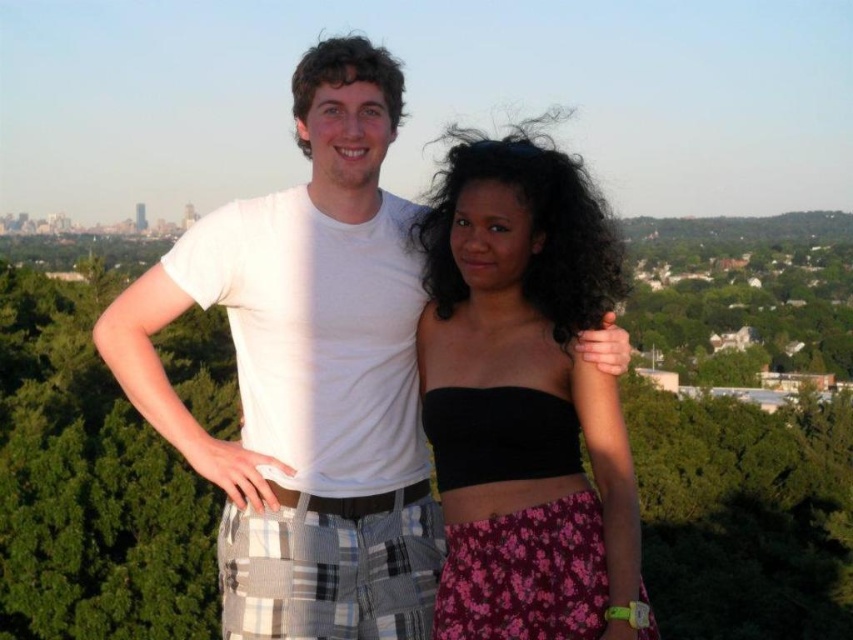
The image size is (853, 640). Find the location of `white cotton t-shirt at center`. white cotton t-shirt at center is located at coordinates (306, 374).

Between white cotton t-shirt at center and black matte strapless top at center, which one appears on the right side from the viewer's perspective?

black matte strapless top at center is more to the right.

The width and height of the screenshot is (853, 640). Identify the location of white cotton t-shirt at center. (306, 374).

You are a GUI agent. You are given a task and a screenshot of the screen. Output one action in this format:
    pyautogui.click(x=<x>, y=<y>)
    Task: Click on the white cotton t-shirt at center
    
    Given the screenshot: What is the action you would take?
    pyautogui.click(x=306, y=374)